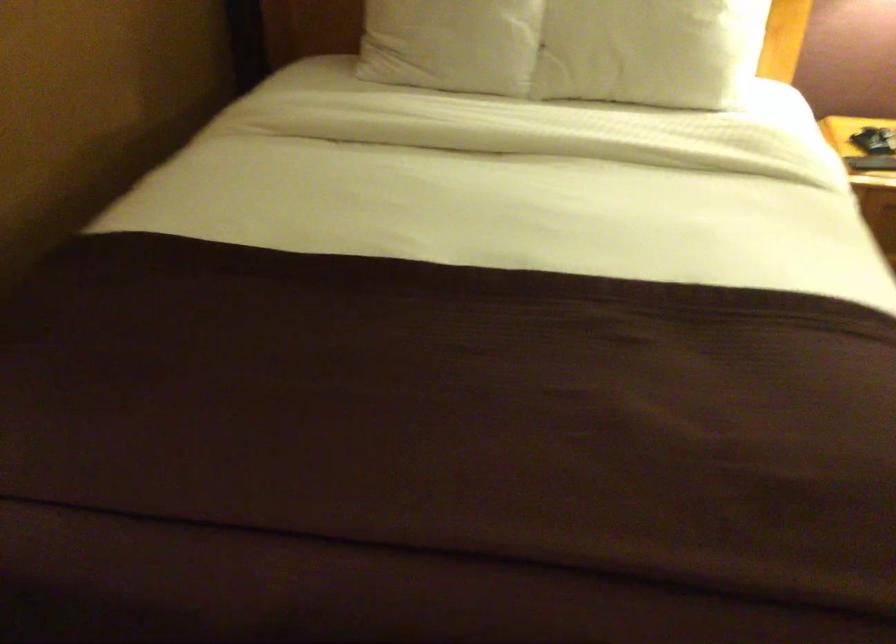
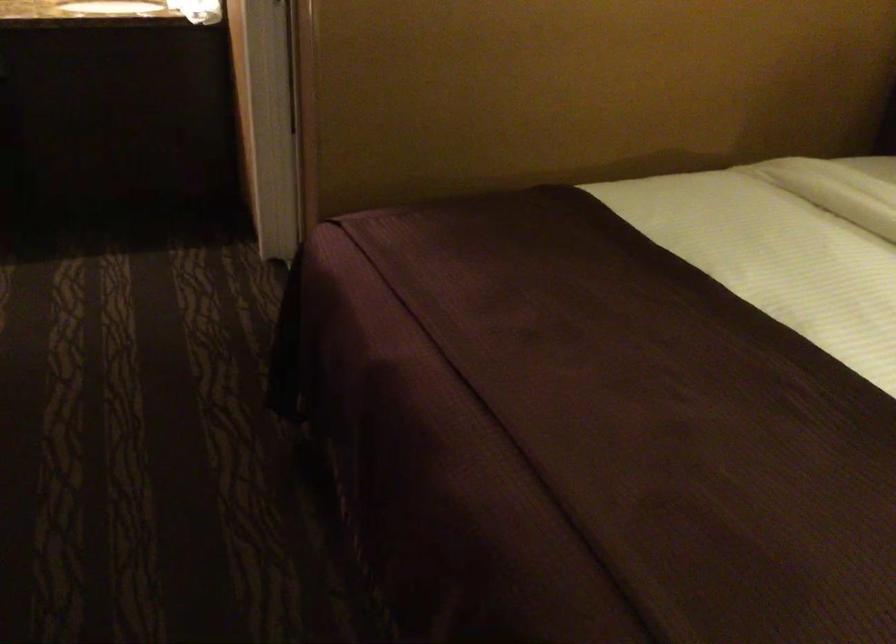
Question: The camera is either moving clockwise (left) or counter-clockwise (right) around the object. The first image is from the beginning of the video and the second image is from the end. Is the camera moving left or right when shooting the video?

Choices:
 (A) Left
 (B) Right

Answer: (B)